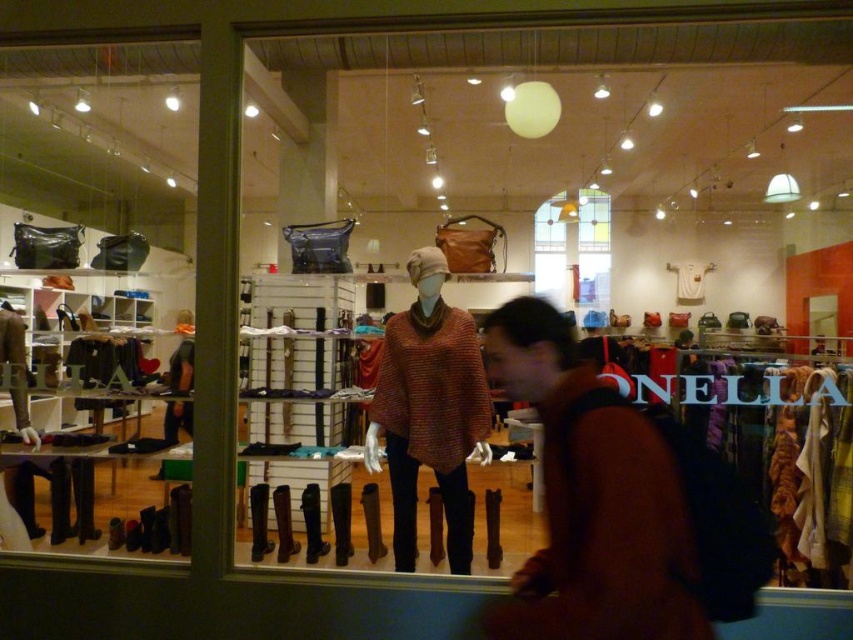
Consider the image. You are a customer trying to decide whether to buy the brown wool sweater at center. You want to know if the matte black boots at lower left would be visible from the storefront window. Considering their heights, can you see the boots over the sweater?

The matte black boots at lower left are taller than the brown wool sweater at center, so yes, the boots would be visible over the sweater from the storefront window.

What item is located at the coordinates point (590, 499) in the clothing store display?

The brown wool sweater at center is located at point (590, 499).

You are a customer looking to buy a gift for a friend who is 6 feet tall. The store has the matte black boots at lower left and the knitwear sweater at center. Which item would be more suitable in terms of size for someone of that height?

The matte black boots at lower left has a greater height compared to the knitwear sweater at center. However, since the sweater is designed to fit a person, it would be more appropriate for someone who is 6 feet tall, while the boots may be too tall unless they are intended for very tall individuals.